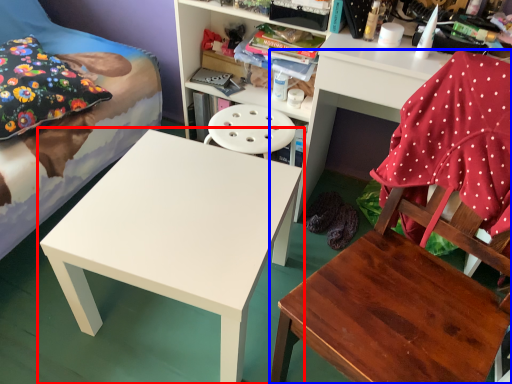
Question: Which object is further to the camera taking this photo, table (highlighted by a red box) or chair (highlighted by a blue box)?

Choices:
 (A) table
 (B) chair

Answer: (A)